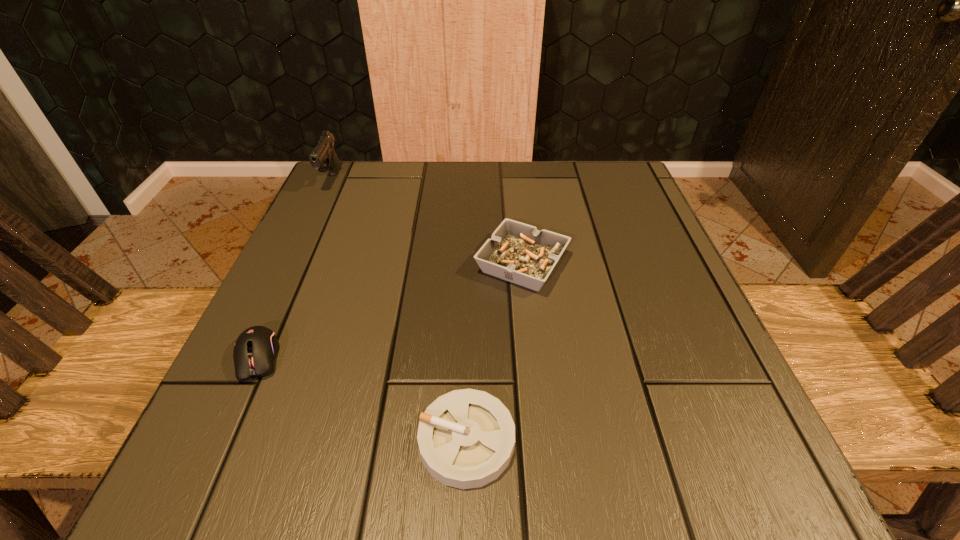
The height and width of the screenshot is (540, 960). Identify the location of free spot between the nearer ashtray and the tallest object. [x=399, y=310].

Where is `free space between the nearer ashtray and the second nearest object`? The image size is (960, 540). free space between the nearer ashtray and the second nearest object is located at coordinates (363, 399).

This screenshot has height=540, width=960. In order to click on free space between the tallest object and the computer mouse in this screenshot , I will do coord(295,268).

Where is `object identified as the second closest to the second nearest object`? This screenshot has height=540, width=960. object identified as the second closest to the second nearest object is located at coordinates (517, 252).

Identify the location of object that can be found as the third closest to the third farthest object. Image resolution: width=960 pixels, height=540 pixels. (323, 157).

Where is `vacant space that satisfies the following two spatial constraints: 1. at the barrel of the nearer ashtray; 2. on the left side of the tallest object`? The image size is (960, 540). vacant space that satisfies the following two spatial constraints: 1. at the barrel of the nearer ashtray; 2. on the left side of the tallest object is located at coordinates (208, 440).

The height and width of the screenshot is (540, 960). What are the coordinates of `vacant position in the image that satisfies the following two spatial constraints: 1. at the barrel of the taller ashtray; 2. on the right side of the farthest object` in the screenshot? It's located at (291, 264).

Find the location of `free location that satisfies the following two spatial constraints: 1. at the barrel of the computer mouse; 2. on the right side of the tallest object`. free location that satisfies the following two spatial constraints: 1. at the barrel of the computer mouse; 2. on the right side of the tallest object is located at coordinates (248, 357).